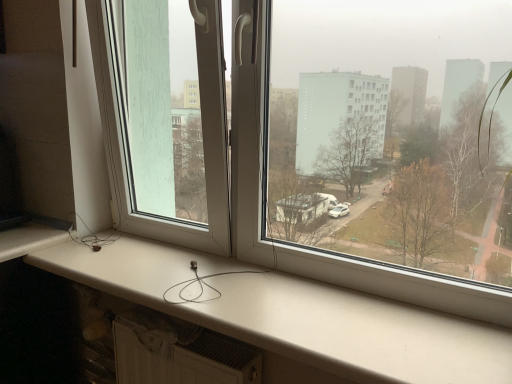
Find the location of `space that is in front of transparent plastic window screen at left`. space that is in front of transparent plastic window screen at left is located at coordinates (141, 281).